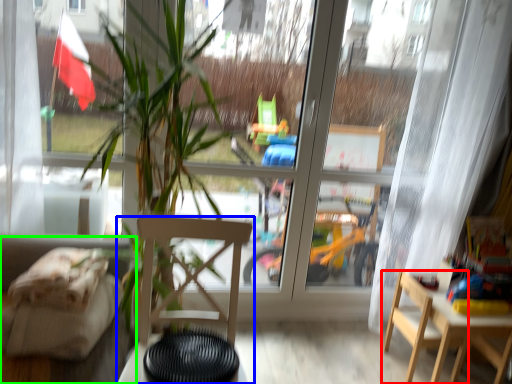
Question: Considering the real-world distances, which object is farthest from chair (highlighted by a red box)? chair (highlighted by a blue box) or couch (highlighted by a green box)?

Choices:
 (A) chair
 (B) couch

Answer: (B)